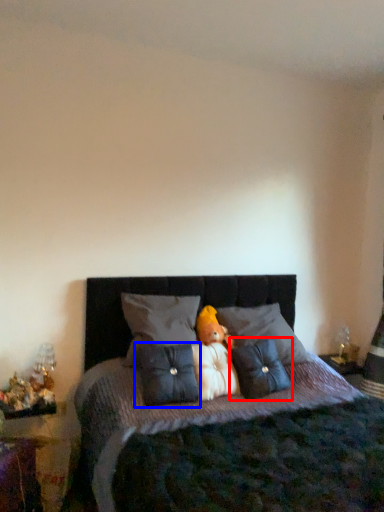
Question: Which object appears farthest to the camera in this image, pillow (highlighted by a red box) or pillow (highlighted by a blue box)?

Choices:
 (A) pillow
 (B) pillow

Answer: (A)